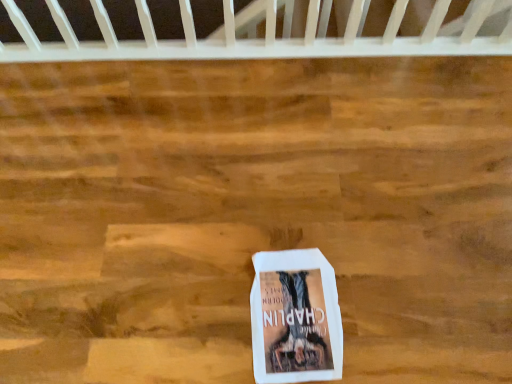
This screenshot has height=384, width=512. Find the location of `free space to the right of white paper book at center`. free space to the right of white paper book at center is located at coordinates (385, 300).